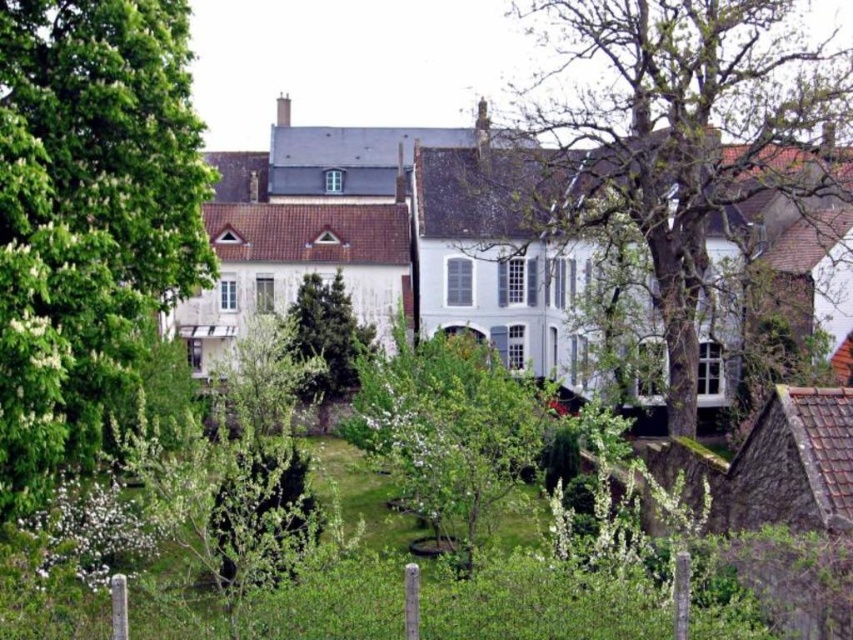
In the scene shown: You are standing in the residential area and want to determine which tree is taller between the smooth bark tree at center and the green textured tree at center. Based on the scene description, which one is taller?

The smooth bark tree at center is taller than the green textured tree at center according to the description.

You are standing in the residential area and want to take a photo of both the green leafy tree at center and the green textured tree at center. Which tree should you position yourself to the left of to capture both in the frame?

You should position yourself to the left of the green textured tree at center because the green leafy tree at center is located to its right, so both will be in the frame when you stand there.

You are standing in the residential area and want to know which tree is taller between the green leafy tree at center and the green textured tree at center. Based on the scene, can you determine which one is taller?

The green leafy tree at center is taller than the green textured tree at center because it is positioned above it in the scene.